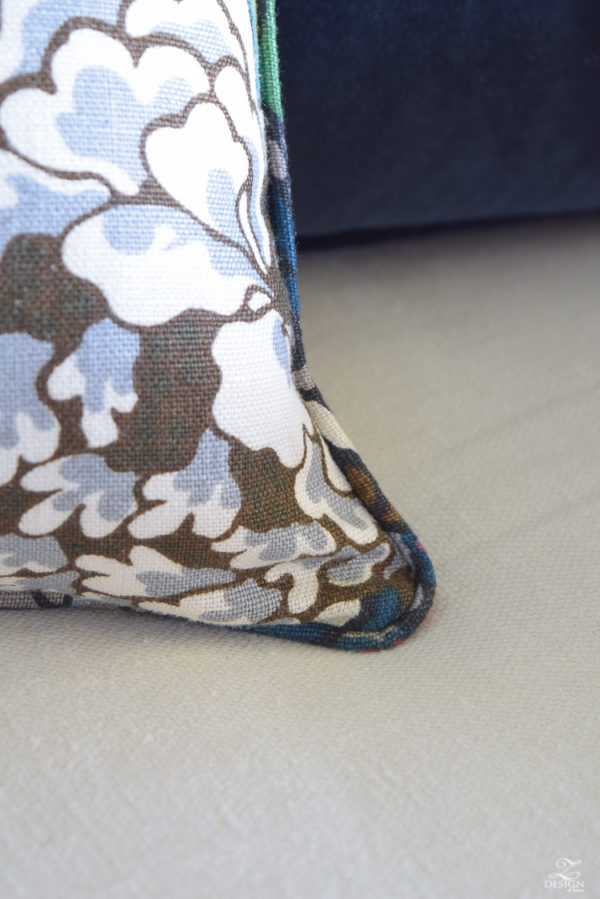
The image size is (600, 899). I want to click on floral patterned pillow, so click(x=117, y=93).